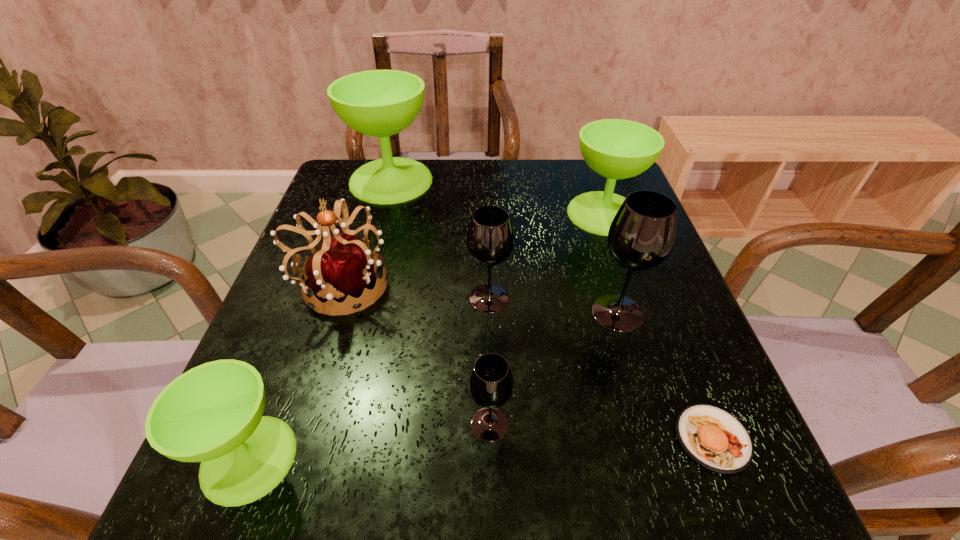
You are a GUI agent. You are given a task and a screenshot of the screen. Output one action in this format:
    pyautogui.click(x=<x>, y=<y>)
    Task: Click on the object that is at the far left corner
    Image resolution: width=960 pixels, height=540 pixels.
    Given the screenshot: What is the action you would take?
    pyautogui.click(x=380, y=103)

Identify the location of object that is at the near left corner. This screenshot has width=960, height=540. (213, 413).

The image size is (960, 540). In order to click on object located at the far right corner in this screenshot , I will do `click(617, 149)`.

Identify the location of object that is at the near right corner. Image resolution: width=960 pixels, height=540 pixels. (714, 438).

This screenshot has width=960, height=540. I want to click on free space at the near edge of the desktop, so click(x=583, y=487).

Find the location of `free region at the left edge of the desktop`. free region at the left edge of the desktop is located at coordinates (313, 390).

The width and height of the screenshot is (960, 540). In the image, there is a desktop. What are the coordinates of `vacant space at the right edge` in the screenshot? It's located at (667, 328).

In the image, there is a desktop. At what (x,y) coordinates should I click in order to perform the action: click on free space at the near left corner. Please return your answer as a coordinate pair (x, y). Looking at the image, I should click on (289, 512).

Where is `free space between the biggest gray wineglass and the second biggest green wineglass`? Image resolution: width=960 pixels, height=540 pixels. free space between the biggest gray wineglass and the second biggest green wineglass is located at coordinates (611, 262).

This screenshot has height=540, width=960. I want to click on blank region between the second biggest gray wineglass and the rightmost green wineglass, so click(546, 256).